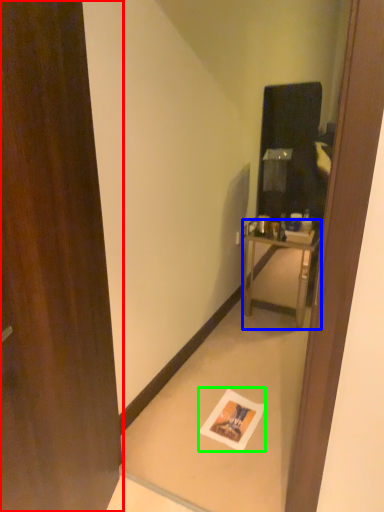
Question: Which object is the closest to the door (highlighted by a red box)? Choose among these: nightstand (highlighted by a blue box) or postcard (highlighted by a green box).

Choices:
 (A) nightstand
 (B) postcard

Answer: (B)